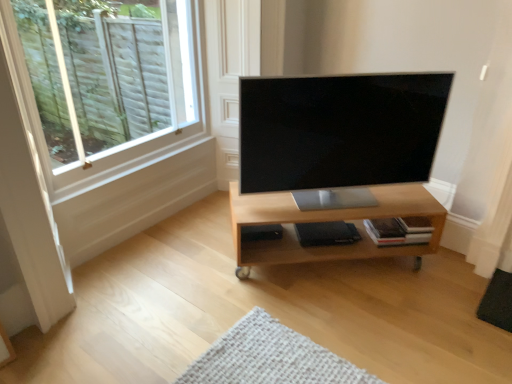
Locate an element on the screen. vacant space positioned to the left of light wood shelf at center is located at coordinates (193, 272).